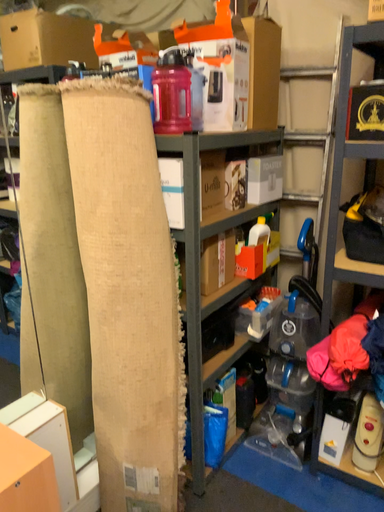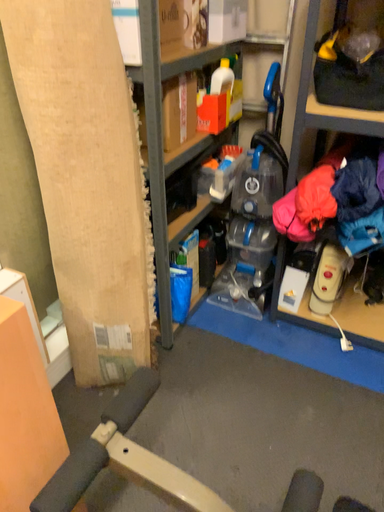
Question: How did the camera likely rotate when shooting the video?

Choices:
 (A) rotated upward
 (B) rotated downward

Answer: (B)